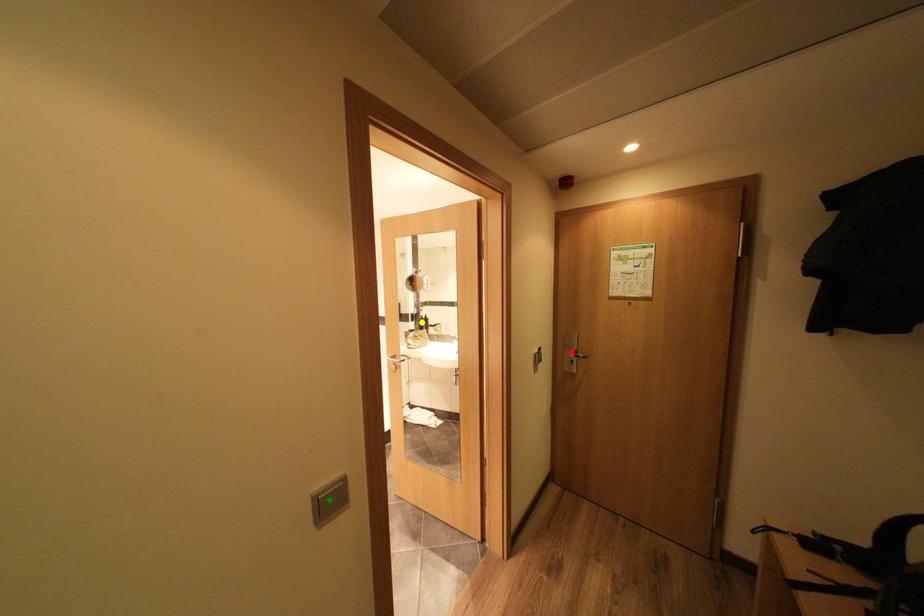
Order these from farthest to nearest:
A) yellow point
B) red point
C) green point

yellow point
red point
green point